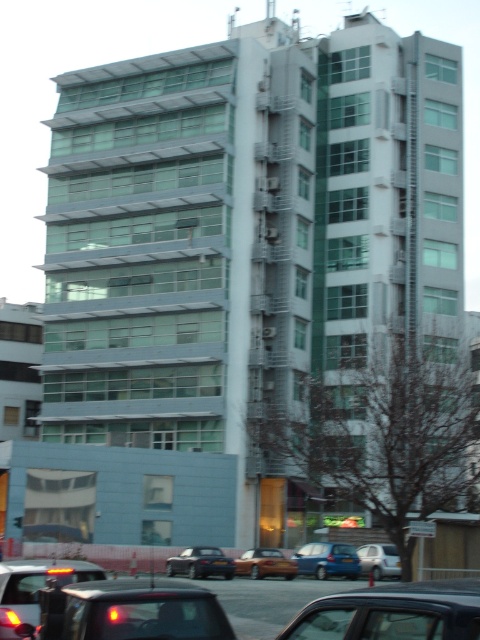
Is metallic blue sedan at center taller than silver metallic sedan at center?

No, metallic blue sedan at center is not taller than silver metallic sedan at center.

Who is positioned more to the left, metallic blue sedan at center or silver metallic sedan at center?

metallic blue sedan at center

Between point (333, 570) and point (387, 564), which one is positioned in front?

Point (387, 564) is more forward.

Identify the location of metallic blue sedan at center. Image resolution: width=480 pixels, height=640 pixels. (327, 560).

Who is lower down, metallic blue sedan at center or shiny black sedan at center?

shiny black sedan at center

Is point (325, 577) behind point (192, 570)?

Yes, point (325, 577) is farther from viewer.

The image size is (480, 640). I want to click on metallic blue sedan at center, so click(x=327, y=560).

Between shiny black sedan at center and black plastic license plate at center, which one has more height?

shiny black sedan at center

At what (x,y) coordinates should I click in order to perform the action: click on shiny black sedan at center. Please return your answer as a coordinate pair (x, y). Looking at the image, I should click on (200, 563).

The width and height of the screenshot is (480, 640). I want to click on shiny black sedan at center, so click(200, 563).